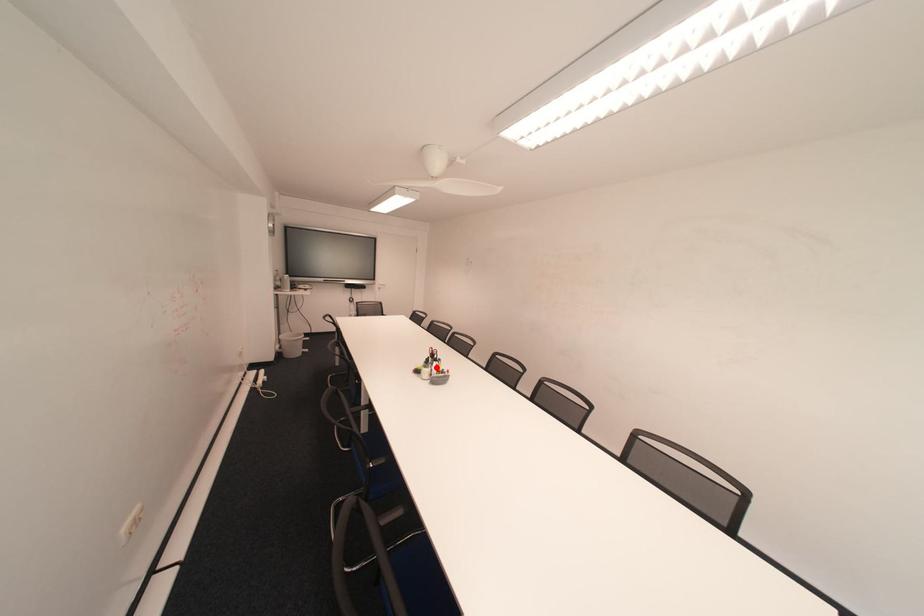
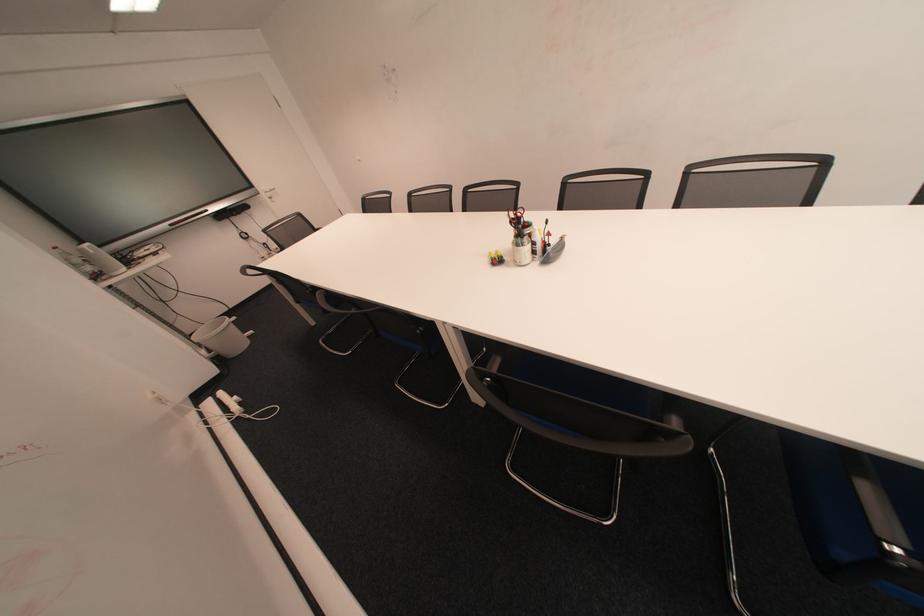
Find the pixel in the second image that matches the highlighted location in the first image.

(529, 245)